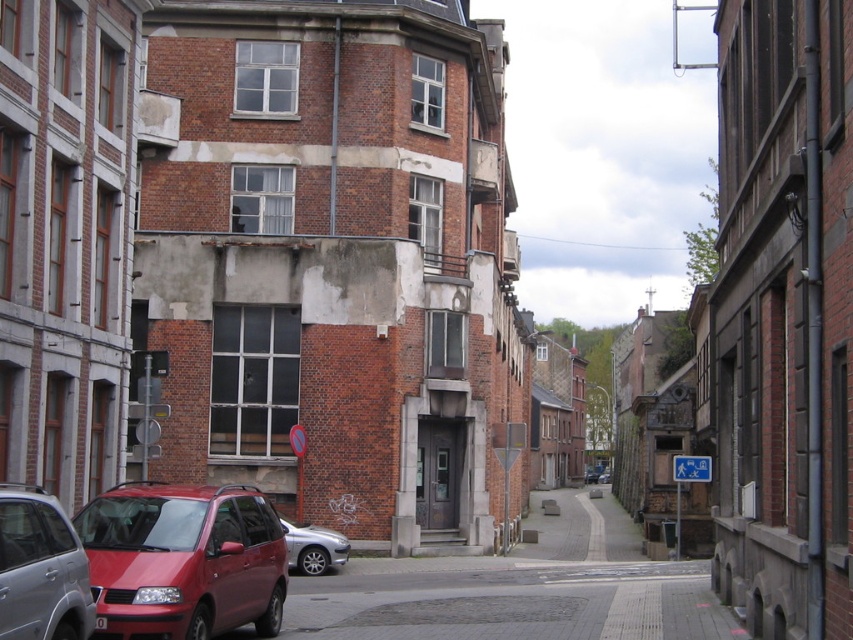
Can you confirm if silver metallic car at center is positioned below matte red van at center?

No, silver metallic car at center is not below matte red van at center.

Describe the element at coordinates (312, 547) in the screenshot. The image size is (853, 640). I see `silver metallic car at center` at that location.

At what (x,y) coordinates should I click in order to perform the action: click on silver metallic car at center. Please return your answer as a coordinate pair (x, y). Looking at the image, I should click on (312, 547).

You are a GUI agent. You are given a task and a screenshot of the screen. Output one action in this format:
    pyautogui.click(x=<x>, y=<y>)
    Task: Click on the silver metallic car at center
    The width and height of the screenshot is (853, 640).
    Given the screenshot: What is the action you would take?
    click(x=312, y=547)

Does matte red car at lower left have a lesser height compared to metallic red car at center?

Indeed, matte red car at lower left has a lesser height compared to metallic red car at center.

Locate an element on the screen. The image size is (853, 640). matte red car at lower left is located at coordinates (39, 568).

Between point (196, 616) and point (606, 468), which one is positioned in front?

Positioned in front is point (196, 616).

Locate an element on the screen. matte red minivan at lower left is located at coordinates [x=183, y=561].

Where is `matte red minivan at lower left`? The width and height of the screenshot is (853, 640). matte red minivan at lower left is located at coordinates (183, 561).